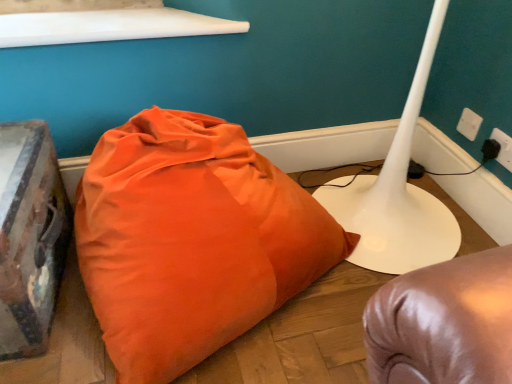
Question: Does white plastic electric outlet at upper right, which is the 2th electric outlet in front-to-back order, have a greater height compared to black plastic plug at lower right?

Choices:
 (A) yes
 (B) no

Answer: (A)

Question: Is white plastic electric outlet at upper right, which is the 2th electric outlet from bottom to top, to the right of black plastic plug at lower right from the viewer's perspective?

Choices:
 (A) no
 (B) yes

Answer: (A)

Question: Considering the relative sizes of white plastic electric outlet at upper right, the 1th electric outlet when ordered from back to front, and black plastic plug at lower right in the image provided, is white plastic electric outlet at upper right, the 1th electric outlet when ordered from back to front, wider than black plastic plug at lower right?

Choices:
 (A) yes
 (B) no

Answer: (B)

Question: Does white plastic electric outlet at upper right, which is counted as the second electric outlet, starting from the right, have a larger size compared to black plastic plug at lower right?

Choices:
 (A) yes
 (B) no

Answer: (A)

Question: Is white plastic electric outlet at upper right, which is counted as the second electric outlet, starting from the right, facing towards black plastic plug at lower right?

Choices:
 (A) no
 (B) yes

Answer: (A)

Question: Looking at their shapes, would you say orange fabric pillow at center is wider or thinner than white plastic electric outlet at upper right, the first electric outlet when ordered from right to left?

Choices:
 (A) thin
 (B) wide

Answer: (B)

Question: Is orange fabric pillow at center inside the boundaries of white plastic electric outlet at upper right, acting as the 1th electric outlet starting from the bottom, or outside?

Choices:
 (A) inside
 (B) outside

Answer: (B)

Question: Considering the positions of point (168, 193) and point (501, 160), is point (168, 193) closer or farther from the camera than point (501, 160)?

Choices:
 (A) closer
 (B) farther

Answer: (A)

Question: Is orange fabric pillow at center taller or shorter than white plastic electric outlet at upper right, the second electric outlet in the left-to-right sequence?

Choices:
 (A) tall
 (B) short

Answer: (A)

Question: Considering the positions of point click(x=342, y=251) and point click(x=466, y=114), is point click(x=342, y=251) closer or farther from the camera than point click(x=466, y=114)?

Choices:
 (A) closer
 (B) farther

Answer: (A)

Question: From a real-world perspective, is orange fabric pillow at center above or below white plastic electric outlet at upper right, which is the 2th electric outlet in front-to-back order?

Choices:
 (A) above
 (B) below

Answer: (B)

Question: Looking at their shapes, would you say orange fabric pillow at center is wider or thinner than white plastic electric outlet at upper right, the 1th electric outlet when ordered from back to front?

Choices:
 (A) wide
 (B) thin

Answer: (A)

Question: Which is correct: orange fabric pillow at center is inside white plastic electric outlet at upper right, which is the 2th electric outlet in front-to-back order, or outside of it?

Choices:
 (A) inside
 (B) outside

Answer: (B)

Question: Relative to white plastic electric outlet at upper right, acting as the 2th electric outlet starting from the top, is white plastic electric outlet at upper right, which is the 2th electric outlet from bottom to top, in front or behind?

Choices:
 (A) behind
 (B) front

Answer: (A)

Question: Is point (464, 132) positioned closer to the camera than point (507, 157)?

Choices:
 (A) farther
 (B) closer

Answer: (A)